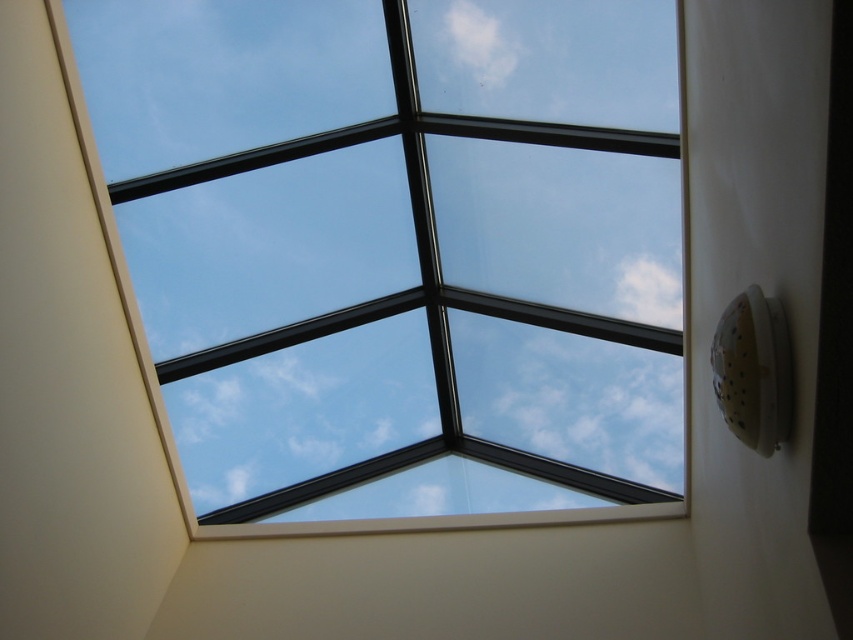
You are an interior designer assessing the skylight installation. You need to determine if the white fluffy cloud at upper center will be entirely visible through the transparent glass skylight at upper center. Based on their sizes, can the cloud be fully seen?

The transparent glass skylight at upper center is wider than the white fluffy cloud at upper center. Since the skylight is larger in width, the entire cloud should be visible through it.

You are an interior designer assessing the skylight installation. You notice the transparent glass skylight at upper center and the white fluffy cloud at upper center. Which object occupies more space in the image?

The transparent glass skylight at upper center is larger in size than the white fluffy cloud at upper center, so it occupies more space in the image.

You are standing inside a building and looking up at the transparent glass skylight at upper center. If you want to take a photo of the sky through the skylight, where should you position your camera relative to the center of the room?

The transparent glass skylight at upper center is positioned at point coordinates of 0.392 on the x axis and 0.461 on the y axis. This means the skylight is slightly to the left and lower than the exact center of the room. To capture the sky through it, you should position your camera slightly to the left and lower than the room center.